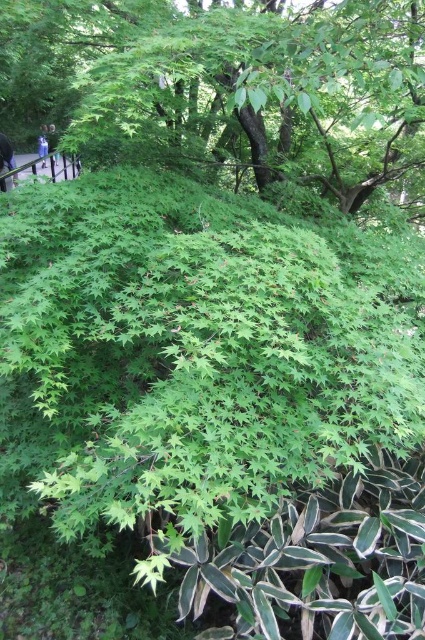
You are planning to take a photo of the blue denim jeans at upper left and the blue fabric person at upper left in the lush green landscape. To ensure both subjects are in focus, you need to know their relative sizes. Which one is smaller?

The blue denim jeans at upper left is shorter than the blue fabric person at upper left, so the blue denim jeans at upper left is smaller.

You are standing in a forest and see the blue denim jeans at upper left. You want to take a photo of them using your camera. Can you reach the jeans with your camera from your current position?

The blue denim jeans at upper left and camera are 3.72 meters apart. Since the distance between them is 3.72 meters, which is within the typical range of a camera lens, you can likely take a photo of the blue denim jeans at upper left from your current position.